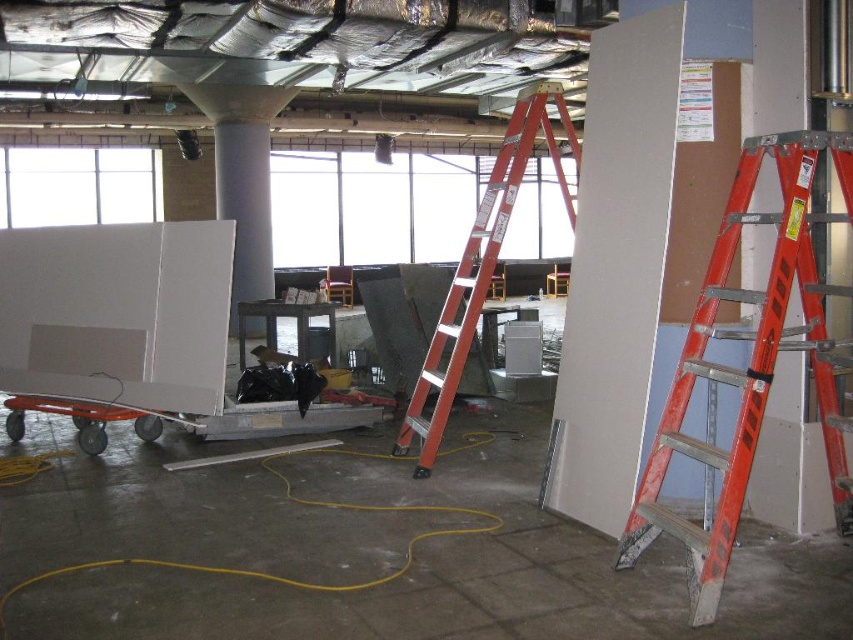
Question: Observing the image, what is the correct spatial positioning of smooth white pillar at right in reference to white smooth column at center?

Choices:
 (A) right
 (B) left

Answer: (A)

Question: Does orange metallic ladder at center appear under white smooth column at center?

Choices:
 (A) no
 (B) yes

Answer: (B)

Question: Can you confirm if orange metallic ladder at center is positioned to the right of white smooth column at center?

Choices:
 (A) yes
 (B) no

Answer: (A)

Question: Which object is farther from the camera taking this photo?

Choices:
 (A) orange metallic ladder at center
 (B) orange metallic ladder at right

Answer: (A)

Question: Which object appears farthest from the camera in this image?

Choices:
 (A) orange metallic ladder at right
 (B) smooth white pillar at right
 (C) orange metallic ladder at center
 (D) white smooth column at center

Answer: (D)

Question: Which point is closer to the camera taking this photo?

Choices:
 (A) (708, 556)
 (B) (764, 33)

Answer: (A)